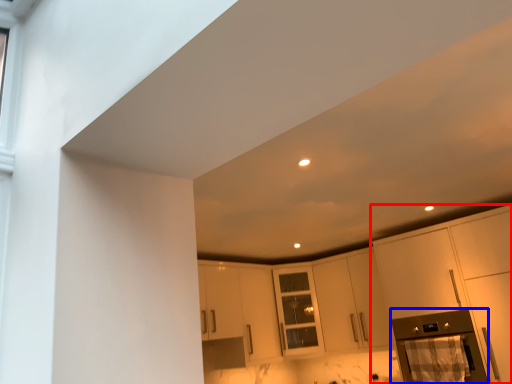
Question: Which point is further to the camera, cabinetry (highlighted by a red box) or appliance (highlighted by a blue box)?

Choices:
 (A) cabinetry
 (B) appliance

Answer: (B)